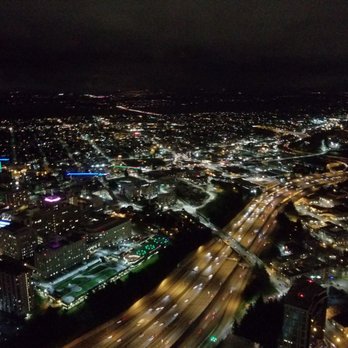
Identify the location of pink light. (45, 200), (49, 201), (55, 199).